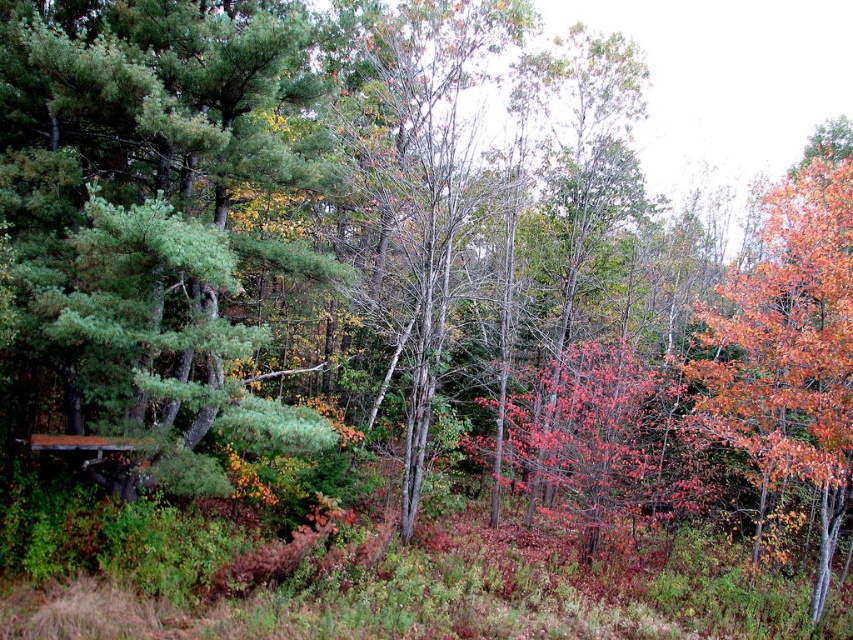
Question: Is orange-brown bark tree at right positioned in front of wooden picnic table at lower left?

Choices:
 (A) no
 (B) yes

Answer: (A)

Question: Which point is closer to the camera taking this photo?

Choices:
 (A) (834, 298)
 (B) (433, 241)

Answer: (A)

Question: Is smooth bark tree at center to the left of wooden picnic table at lower left from the viewer's perspective?

Choices:
 (A) no
 (B) yes

Answer: (A)

Question: Which of these objects is positioned farthest from the smooth bark tree at center?

Choices:
 (A) wooden picnic table at lower left
 (B) orange-brown bark tree at right

Answer: (A)

Question: Is smooth bark tree at center smaller than wooden picnic table at lower left?

Choices:
 (A) no
 (B) yes

Answer: (A)

Question: Which object is the closest to the smooth bark tree at center?

Choices:
 (A) wooden picnic table at lower left
 (B) orange-brown bark tree at right

Answer: (B)